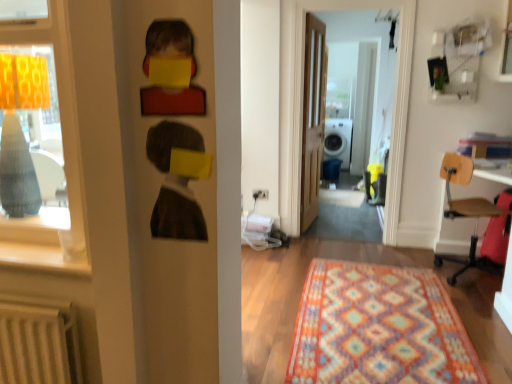
Where is `free point above matte wood window sill at left (from a real-world perspective)`? The image size is (512, 384). free point above matte wood window sill at left (from a real-world perspective) is located at coordinates (50, 246).